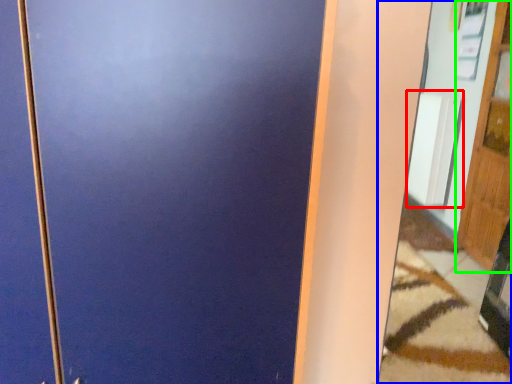
Question: Which object is the closest to the radiator (highlighted by a red box)? Choose among these: mirror (highlighted by a blue box) or door (highlighted by a green box).

Choices:
 (A) mirror
 (B) door

Answer: (A)